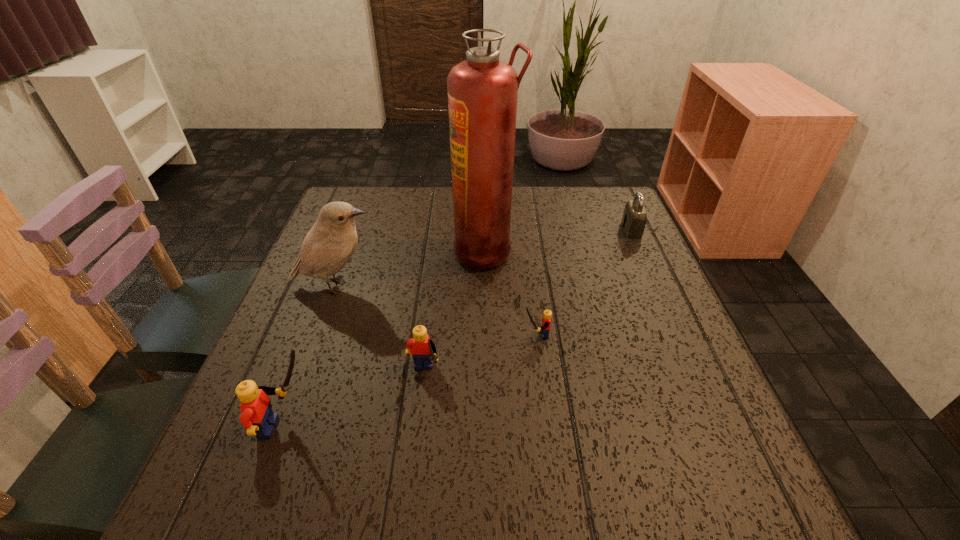
Where is `free space between the fire extinguisher and the leftmost Lego`? The height and width of the screenshot is (540, 960). free space between the fire extinguisher and the leftmost Lego is located at coordinates (387, 339).

Locate an element on the screen. This screenshot has height=540, width=960. vacant space that is in between the tallest object and the padlock is located at coordinates [559, 240].

In order to click on vacant area that lies between the fire extinguisher and the nearest object in this screenshot , I will do `click(387, 339)`.

Image resolution: width=960 pixels, height=540 pixels. In order to click on object that is the fourth closest to the rightmost object in this screenshot , I will do `click(330, 243)`.

Choose which object is the third nearest neighbor to the fire extinguisher. Please provide its 2D coordinates. Your answer should be formatted as a tuple, i.e. [(x, y)], where the tuple contains the x and y coordinates of a point satisfying the conditions above.

[(422, 349)]

Locate an element on the screen. The height and width of the screenshot is (540, 960). Lego that is the second closest to the third object from left to right is located at coordinates (547, 314).

I want to click on Lego object that ranks as the second closest to the nearest object, so click(547, 314).